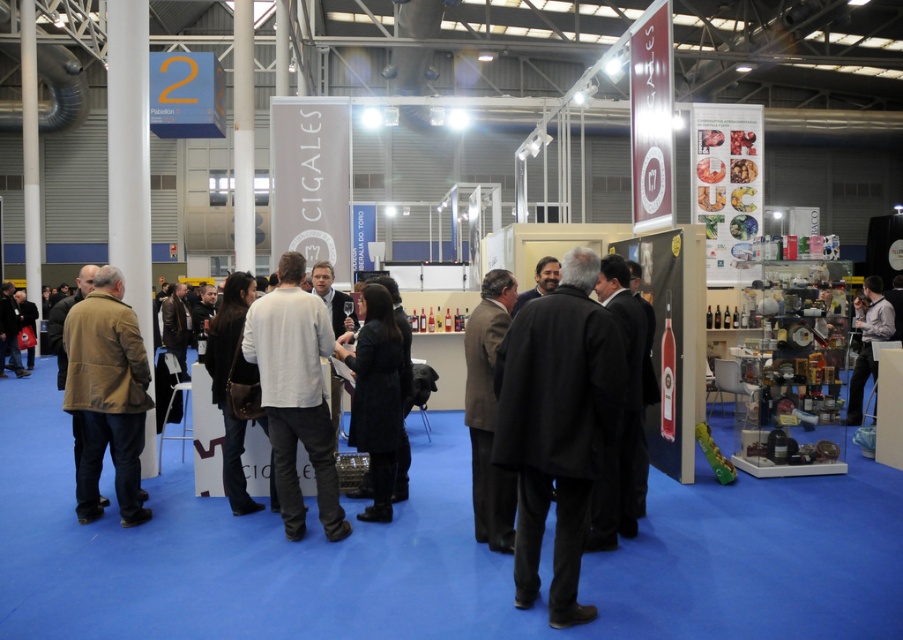
You are at the exhibition hall and want to find the dark wool coat at center. According to the coordinates given, where should you look in the image?

The dark wool coat at center is located at coordinates point (557, 426).

You are a fashion designer observing the exhibition and notice two shirts displayed at the booth. The white cotton shirt at center and the gray fabric shirt at right. Which shirt is taller?

The white cotton shirt at center has a greater height compared to the gray fabric shirt at right, so the white cotton shirt at center is taller.

From the picture: You are standing at the entrance of the exhibition hall and see the white cotton shirt at center displayed in the CIGALES booth. If you want to examine it closely, how many steps would you need to take to reach it, assuming each step covers approximately 0.7 meters?

The white cotton shirt at center is 4.44 meters away from the camera. Since each step covers approximately 0.7 meters, dividing 4.44 by 0.7 gives approximately 6.34 steps. Therefore, you would need to take about 6 to 7 steps to reach the white cotton shirt at center.